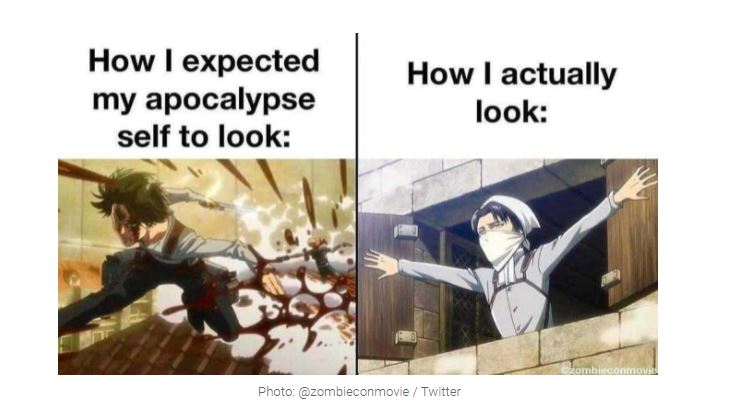
Where is `wood shutters`? This screenshot has height=412, width=733. wood shutters is located at coordinates (630, 245).